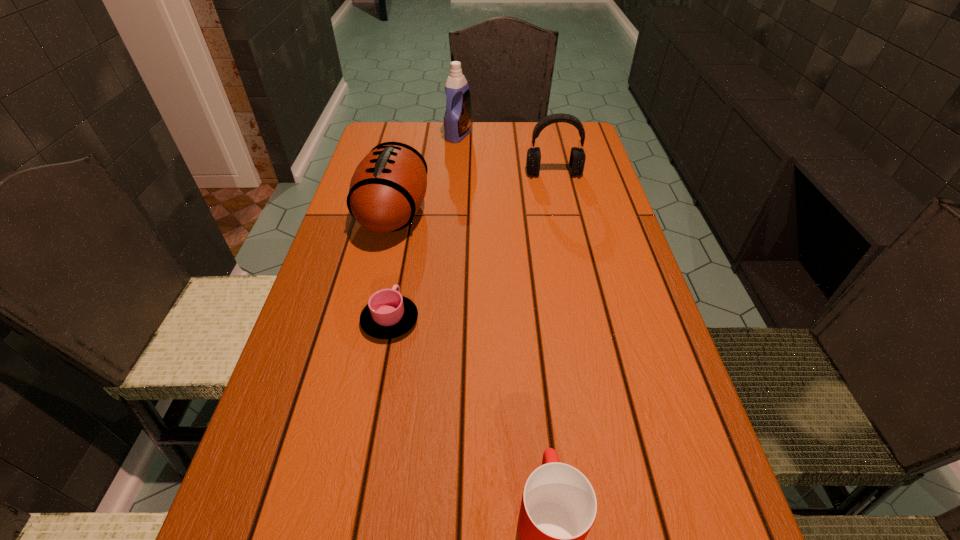
Identify the location of vacant space that is in between the shortest object and the third nearest object. This screenshot has width=960, height=540. (392, 267).

In order to click on free space between the second farthest object and the third farthest object in this screenshot , I will do `click(474, 193)`.

Locate an element on the screen. This screenshot has height=540, width=960. vacant space in between the headset and the football (American) is located at coordinates (474, 193).

Locate an element on the screen. This screenshot has height=540, width=960. vacant area that lies between the detergent and the left cup is located at coordinates (424, 228).

Locate an element on the screen. The width and height of the screenshot is (960, 540). vacant space in between the football (American) and the headset is located at coordinates (474, 193).

Find the location of a particular element. The image size is (960, 540). vacant point located between the headset and the second nearest object is located at coordinates (471, 247).

This screenshot has width=960, height=540. Find the location of `empty space between the headset and the shorter cup`. empty space between the headset and the shorter cup is located at coordinates (471, 247).

At what (x,y) coordinates should I click in order to perform the action: click on free space between the headset and the farther cup. Please return your answer as a coordinate pair (x, y). Looking at the image, I should click on (471, 247).

At what (x,y) coordinates should I click in order to perform the action: click on object that is the fourth closest to the tallest object. Please return your answer as a coordinate pair (x, y). Looking at the image, I should click on (559, 506).

The image size is (960, 540). I want to click on the fourth closest object to the shorter cup, so pyautogui.click(x=457, y=119).